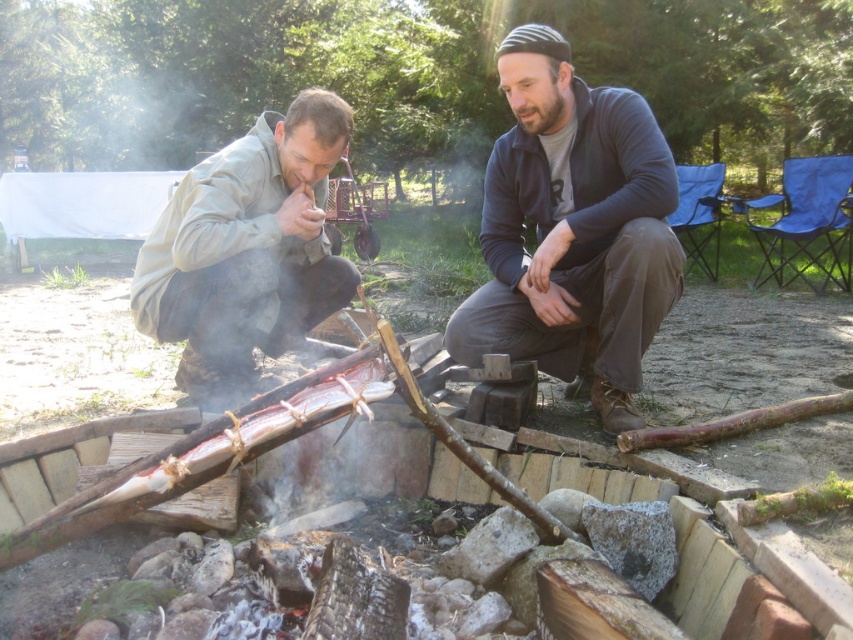
Question: In this image, where is dark blue sweater at center located relative to matte khaki jacket at left?

Choices:
 (A) right
 (B) left

Answer: (A)

Question: Is dark blue sweater at center smaller than matte khaki jacket at left?

Choices:
 (A) no
 (B) yes

Answer: (A)

Question: Is dark blue sweater at center to the right of matte khaki jacket at left from the viewer's perspective?

Choices:
 (A) yes
 (B) no

Answer: (A)

Question: Which point is farther from the camera taking this photo?

Choices:
 (A) (178, 266)
 (B) (578, 307)

Answer: (B)

Question: Which object is closer to the camera taking this photo?

Choices:
 (A) dark blue sweater at center
 (B) matte khaki jacket at left

Answer: (A)

Question: Among these objects, which one is farthest from the camera?

Choices:
 (A) dark blue sweater at center
 (B) matte khaki jacket at left

Answer: (B)